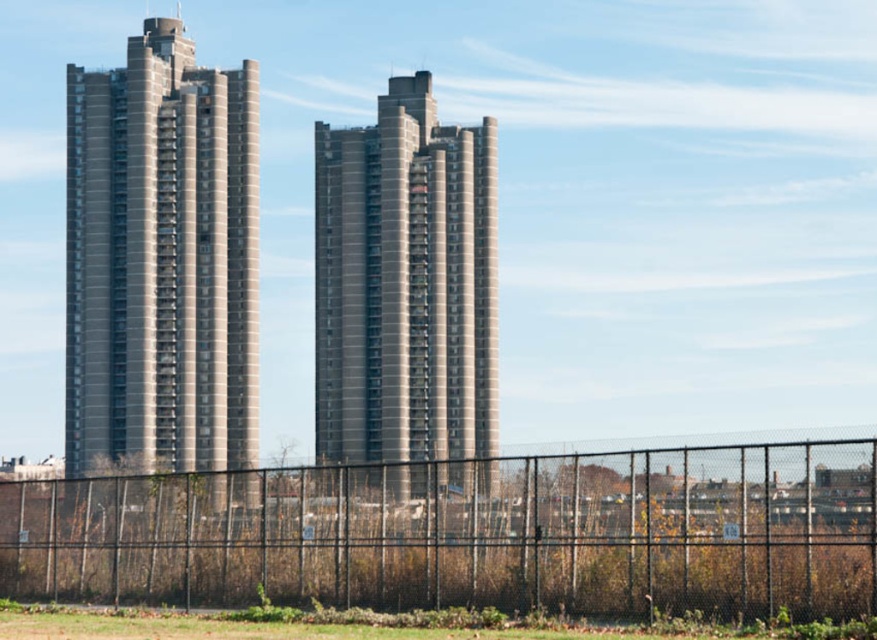
You are standing at the black metal fence at lower center and want to throw a ball to reach the gray concrete building at center. If your throwing distance is 80 meters, will the ball reach the building?

The distance between the black metal fence at lower center and the gray concrete building at center is 84.92 meters. Since your throwing distance is 80 meters, the ball will not reach the building.

You are standing at the lower center of the image and want to reach the two high rise buildings shown. Which direction should you move to avoid the black metal fence at lower center?

The black metal fence at lower center is located at point (467, 532), so to avoid it, you should move in a direction away from that coordinate, such as upwards or to the sides.

You are standing at the point labeled as point (467, 532) in the image. What object are you directly facing?

The point (467, 532) indicates the black metal fence at lower center, so you are directly facing the black metal fence at lower center.